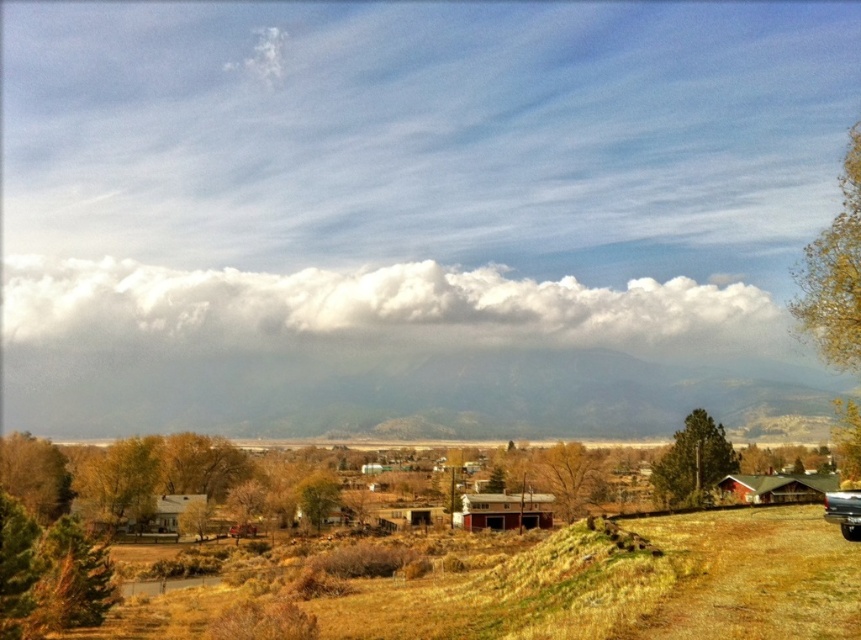
You are driving a car and see the shiny silver truck at lower right parked near the field. There is a white fluffy cloud at upper center in the sky. Which object is positioned more to the east if the sun is setting in the west?

The shiny silver truck at lower right is positioned more to the east than the white fluffy cloud at upper center because the cloud is to the left of the truck, and since the sun is setting in the west, east would be to the right side of the image.

Consider the image. You are a delivery driver who needs to park your shiny silver truck at lower right near the white fluffy cloud at upper center. Can you park the truck directly underneath the cloud?

The white fluffy cloud at upper center is above the shiny silver truck at lower right, but since clouds are in the sky and the truck is on the ground, you cannot park the truck directly underneath the cloud.